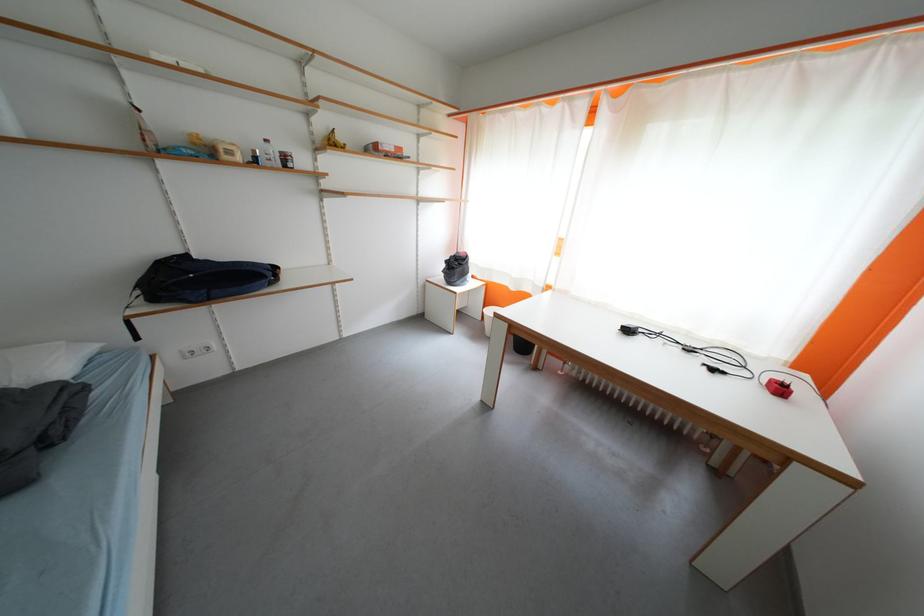
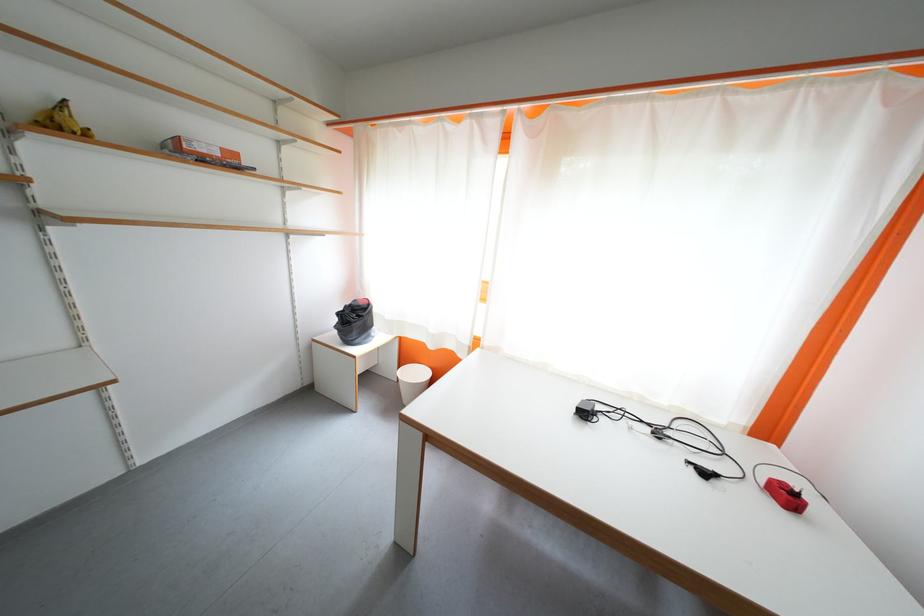
In the second image, find the point that corresponds to the point at 455,265 in the first image.

(347, 317)